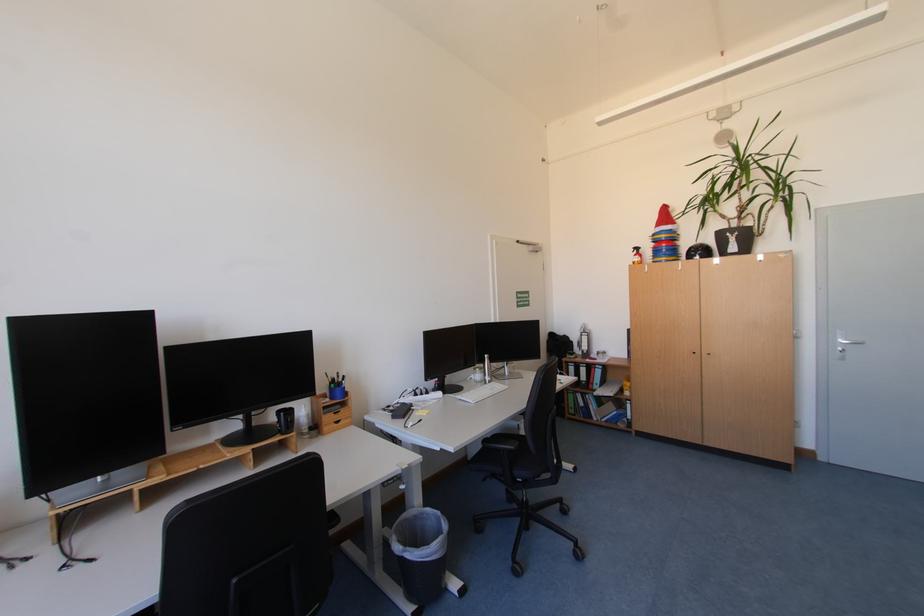
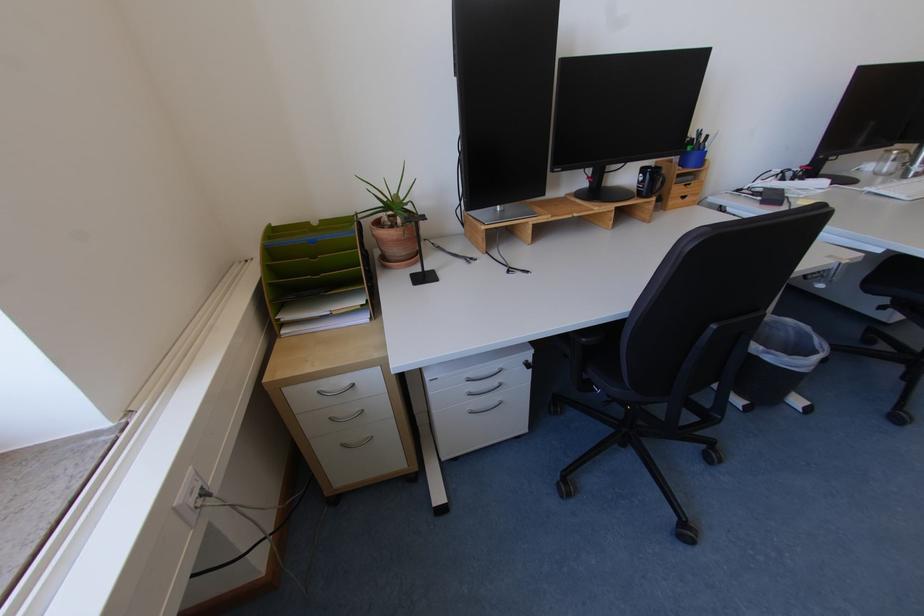
Based on the continuous images, in which direction is the camera rotating?

The rotation direction of the camera is left-down.